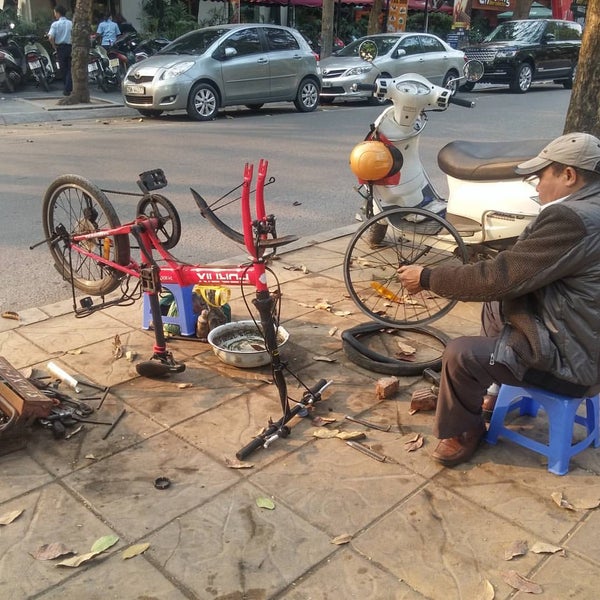
Identify the location of blue stool. This screenshot has height=600, width=600. (509, 395), (180, 312).